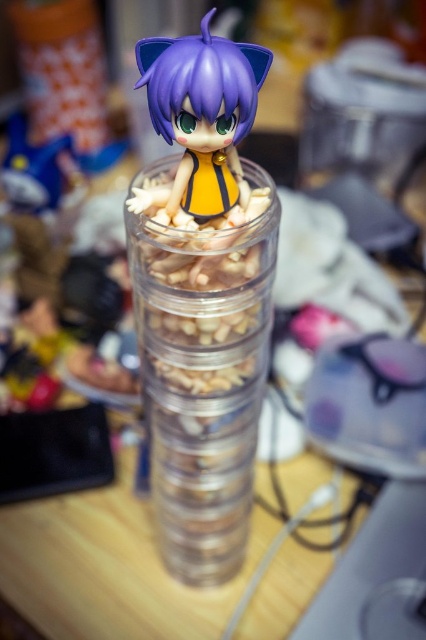
Question: Does transparent plastic container at center have a larger size compared to matte purple figurine at center?

Choices:
 (A) yes
 (B) no

Answer: (A)

Question: Which of the following is the farthest from the observer?

Choices:
 (A) (164, 328)
 (B) (157, 108)

Answer: (A)

Question: Which of the following is the farthest from the observer?

Choices:
 (A) (193, 120)
 (B) (204, 461)

Answer: (B)

Question: Is transparent plastic container at center wider than matte purple figurine at center?

Choices:
 (A) yes
 (B) no

Answer: (A)

Question: In this image, where is transparent plastic container at center located relative to matte purple figurine at center?

Choices:
 (A) left
 (B) right

Answer: (A)